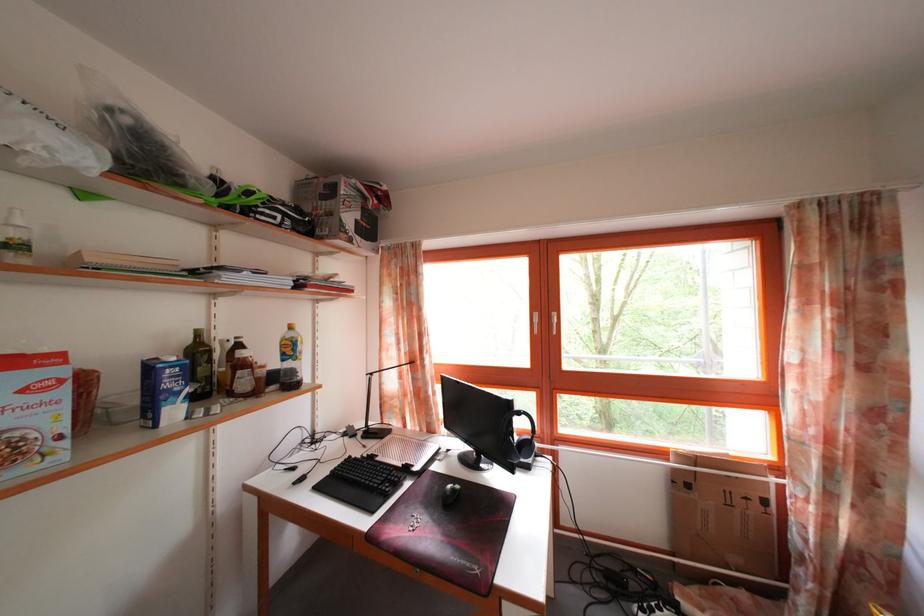
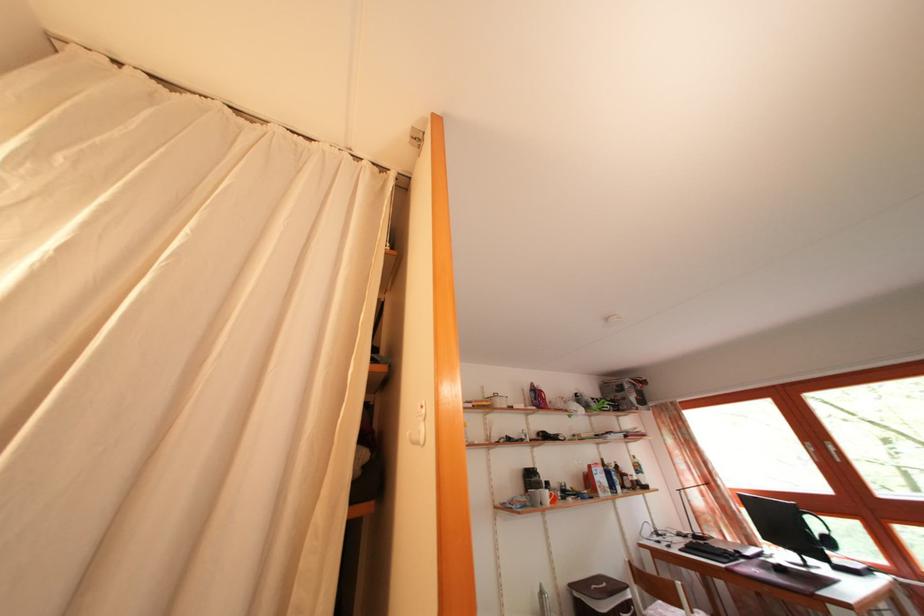
In the second image, find the point that corresponds to [265,368] in the first image.

(636, 480)